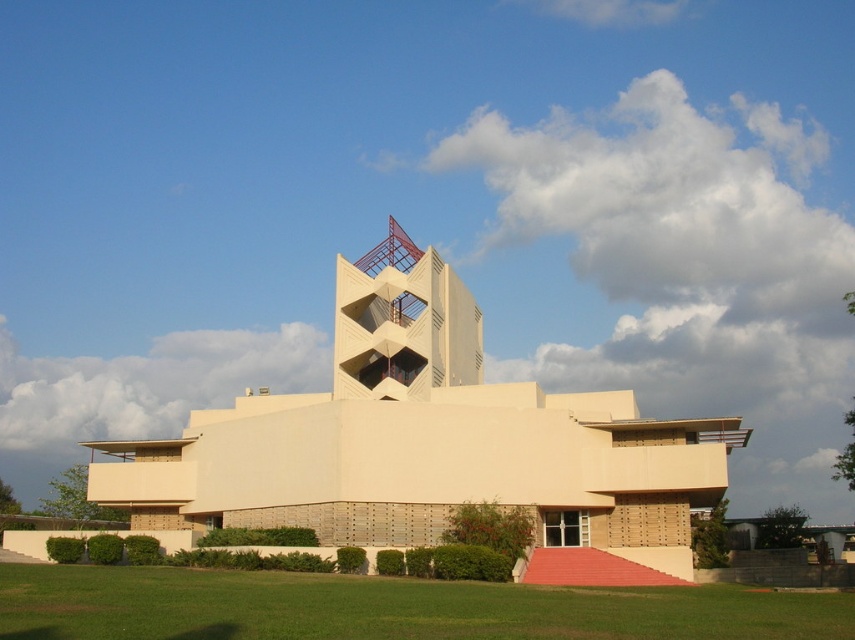
You are standing on the green grass at lower center and want to reach the beige concrete building at center. Which direction should you move to get there?

Since the beige concrete building at center is positioned over the green grass at lower center, you should move upward from the green grass at lower center to reach it.

You are a drone operator trying to capture aerial footage of the beige concrete building at center and the green grass at lower center. Based on their sizes, which object should you focus on first to ensure it fits within the camera frame?

The beige concrete building at center is bigger than the green grass at lower center, so you should focus on capturing the beige concrete building at center first to ensure it fits within the camera frame.